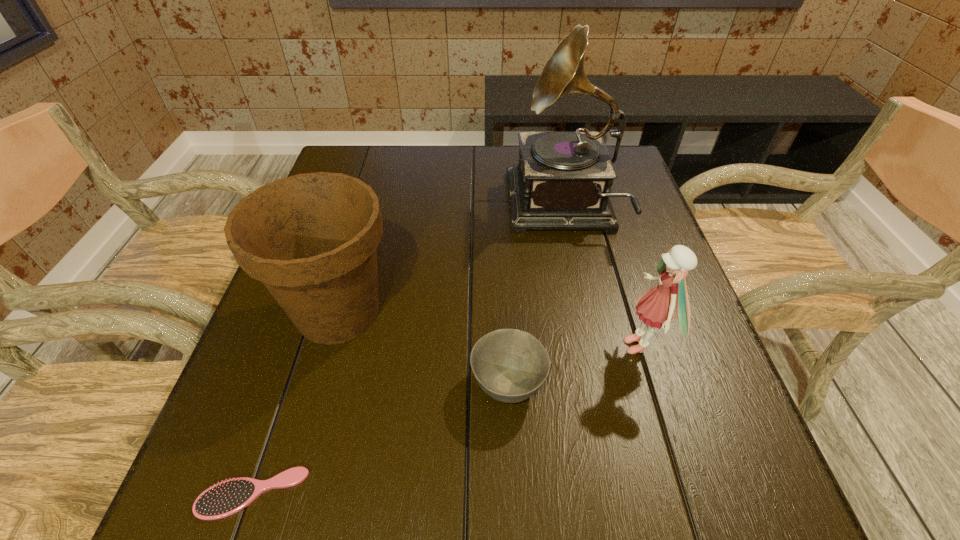
In order to click on free space located 0.210m on the front of the flowerpot in this screenshot , I will do `click(290, 481)`.

Identify the location of free region located on the front-facing side of the doll. (595, 346).

Find the location of a particular element. vacant space situated 0.100m on the front-facing side of the doll is located at coordinates (568, 346).

At what (x,y) coordinates should I click in order to perform the action: click on free space located 0.220m on the front-facing side of the doll. Please return your answer as a coordinate pair (x, y). The height and width of the screenshot is (540, 960). Looking at the image, I should click on (506, 346).

What are the coordinates of `vacant area located 0.080m on the left of the bowl` in the screenshot? It's located at (426, 384).

Locate an element on the screen. This screenshot has height=540, width=960. vacant space located on the right of the hairbrush is located at coordinates pyautogui.click(x=431, y=493).

Locate an element on the screen. This screenshot has width=960, height=540. object present at the far edge is located at coordinates (563, 181).

In order to click on object at the near edge in this screenshot , I will do `click(228, 497)`.

At what (x,y) coordinates should I click in order to perform the action: click on flowerpot located at the left edge. Please return your answer as a coordinate pair (x, y). Looking at the image, I should click on (311, 239).

Where is `hairbrush at the left edge`? hairbrush at the left edge is located at coordinates (228, 497).